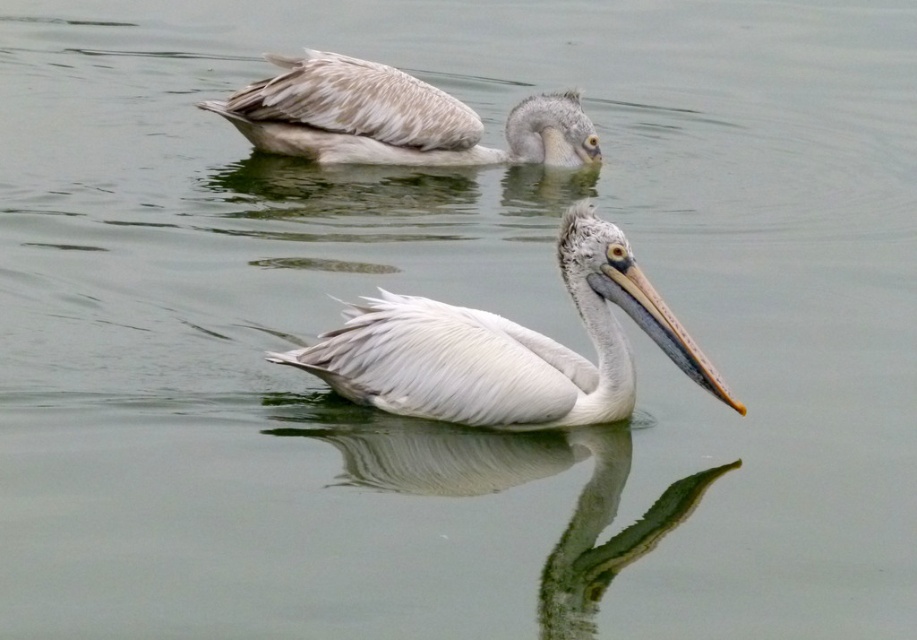
You are a photographer trying to capture the white feathered pelican at center in the image. The camera is set to focus on the point at coordinates point (507,348). Will this point be sufficient to ensure the pelican is in focus?

The white feathered pelican at center is represented by point (507,348), so yes, focusing on this point will ensure the pelican is in focus.